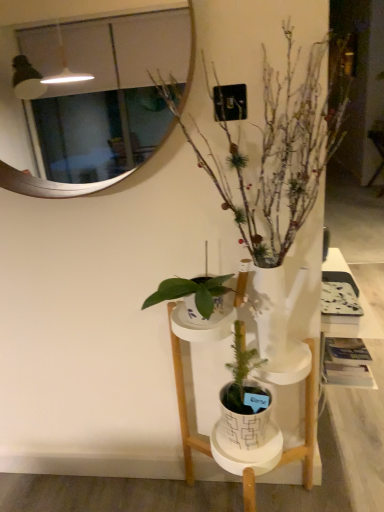
Question: Is white glossy mirror at upper center wider than white ceramic pot at center?

Choices:
 (A) yes
 (B) no

Answer: (B)

Question: Is white glossy mirror at upper center closer to the viewer compared to white ceramic pot at center?

Choices:
 (A) yes
 (B) no

Answer: (B)

Question: Is white ceramic pot at center at the back of white glossy mirror at upper center?

Choices:
 (A) yes
 (B) no

Answer: (B)

Question: Is white glossy mirror at upper center oriented towards white ceramic pot at center?

Choices:
 (A) yes
 (B) no

Answer: (B)

Question: Is white glossy mirror at upper center outside of white ceramic pot at center?

Choices:
 (A) yes
 (B) no

Answer: (A)

Question: Can you confirm if white glossy mirror at upper center is bigger than white ceramic pot at center?

Choices:
 (A) no
 (B) yes

Answer: (A)

Question: Does white glossy mirror at upper center have a lesser height compared to white matte vase at center?

Choices:
 (A) no
 (B) yes

Answer: (B)

Question: Is white glossy mirror at upper center positioned far away from white matte vase at center?

Choices:
 (A) yes
 (B) no

Answer: (B)

Question: From the image's perspective, does white glossy mirror at upper center appear lower than white matte vase at center?

Choices:
 (A) no
 (B) yes

Answer: (A)

Question: Does white glossy mirror at upper center contain white matte vase at center?

Choices:
 (A) no
 (B) yes

Answer: (A)

Question: Is white glossy mirror at upper center oriented towards white matte vase at center?

Choices:
 (A) yes
 (B) no

Answer: (B)

Question: Is white glossy mirror at upper center thinner than white matte vase at center?

Choices:
 (A) yes
 (B) no

Answer: (A)

Question: Is white matte vase at center positioned before white ceramic pot at center?

Choices:
 (A) no
 (B) yes

Answer: (B)